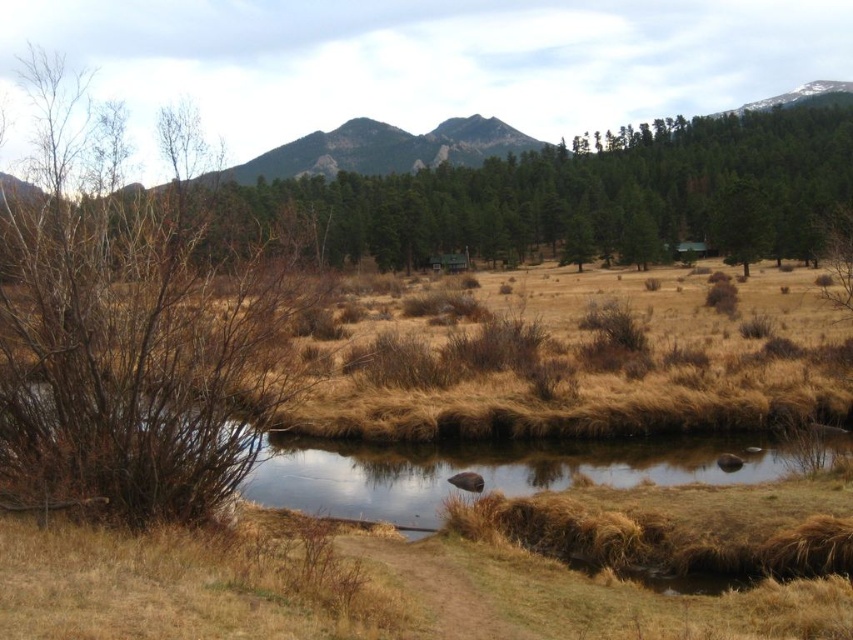
Question: Which object is positioned closest to the brown bare branches at left?

Choices:
 (A) green matte tree at upper center
 (B) brown grassy water at lower center

Answer: (B)

Question: Does green matte tree at upper center come behind brown grassy water at lower center?

Choices:
 (A) yes
 (B) no

Answer: (A)

Question: Which point is farther from the camera taking this photo?

Choices:
 (A) (410, 470)
 (B) (479, 218)

Answer: (B)

Question: Does brown bare branches at left have a greater width compared to green matte tree at upper center?

Choices:
 (A) no
 (B) yes

Answer: (A)

Question: Is green matte tree at upper center to the right of brown grassy water at lower center from the viewer's perspective?

Choices:
 (A) no
 (B) yes

Answer: (B)

Question: Which point is farther to the camera?

Choices:
 (A) green matte tree at upper center
 (B) brown bare branches at left

Answer: (A)